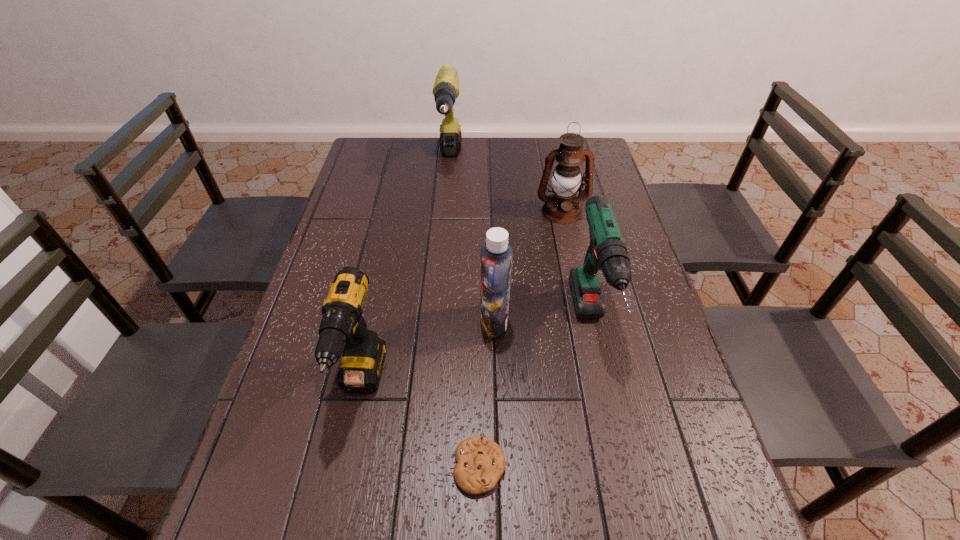
Where is `free space located on the handle side of the rightmost drill`? This screenshot has height=540, width=960. free space located on the handle side of the rightmost drill is located at coordinates (x=624, y=476).

Where is `free space located on the front label of the shampoo`? Image resolution: width=960 pixels, height=540 pixels. free space located on the front label of the shampoo is located at coordinates (350, 322).

Where is `vacant area situated 0.110m on the front label of the shampoo`? The width and height of the screenshot is (960, 540). vacant area situated 0.110m on the front label of the shampoo is located at coordinates (436, 322).

Where is `vacant region located 0.110m on the front label of the shampoo`? This screenshot has height=540, width=960. vacant region located 0.110m on the front label of the shampoo is located at coordinates (436, 322).

Identify the location of vacant area situated 0.190m at the tip of the leftmost object. (329, 539).

Locate an element on the screen. The height and width of the screenshot is (540, 960). free space located on the back of the shortest object is located at coordinates (480, 390).

This screenshot has height=540, width=960. In order to click on object that is at the far edge in this screenshot , I will do `click(446, 87)`.

Identify the location of object that is at the left edge. This screenshot has height=540, width=960. (363, 356).

This screenshot has height=540, width=960. In order to click on lantern that is at the right edge in this screenshot , I will do `click(562, 206)`.

The height and width of the screenshot is (540, 960). Find the location of `drill that is at the right edge`. drill that is at the right edge is located at coordinates (607, 251).